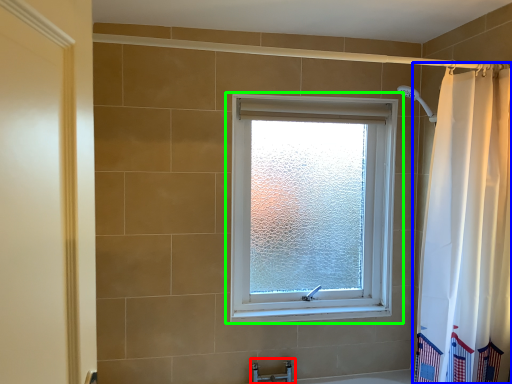
Question: Based on their relative distances, which object is nearer to faucet (highlighted by a red box)? Choose from curtain (highlighted by a blue box) and window (highlighted by a green box).

Choices:
 (A) curtain
 (B) window

Answer: (B)